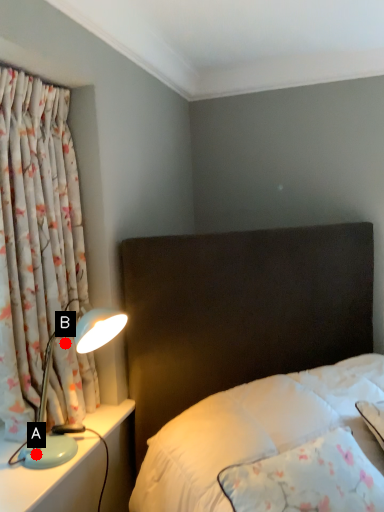
Question: Two points are circled on the image, labeled by A and B beside each circle. Which point is closer to the camera taking this photo?

Choices:
 (A) A is closer
 (B) B is closer

Answer: (A)